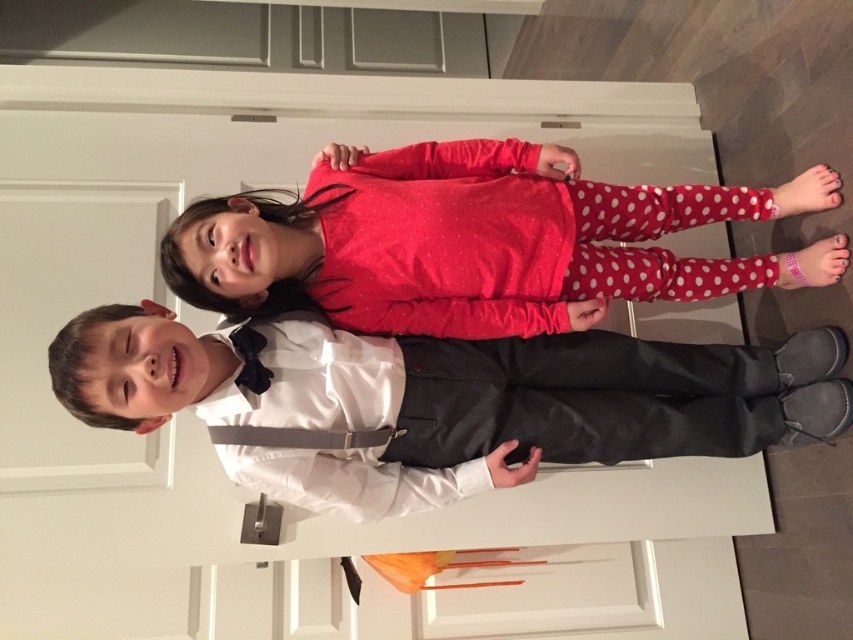
Does white satin shirt at center have a greater height compared to matte red shirt at center?

Correct, white satin shirt at center is much taller as matte red shirt at center.

Between white satin shirt at center and matte red shirt at center, which one is positioned lower?

white satin shirt at center is lower down.

Does point (717, 424) lie in front of point (283, 307)?

No, it is not.

Find the location of a particular element. The width and height of the screenshot is (853, 640). white satin shirt at center is located at coordinates (439, 400).